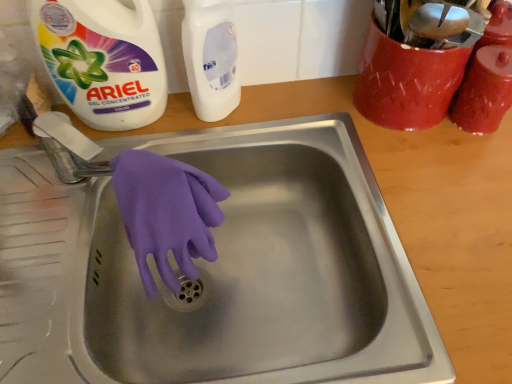
The image size is (512, 384). Find the location of `empty space that is to the right of white gel concentrated at upper left, which ranks as the 1th cleaning product in left-to-right order`. empty space that is to the right of white gel concentrated at upper left, which ranks as the 1th cleaning product in left-to-right order is located at coordinates (227, 123).